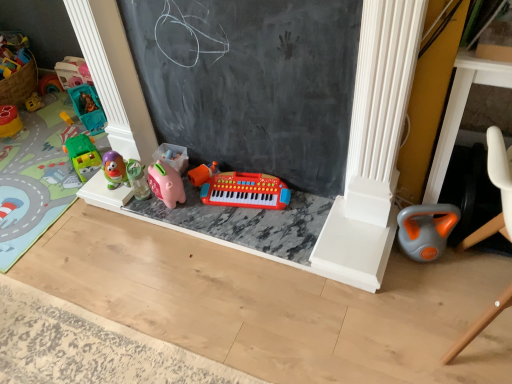
This screenshot has height=384, width=512. Identify the location of free spot in front of pink rubber piggy bank at center, acting as the 3th toy starting from the right. (183, 217).